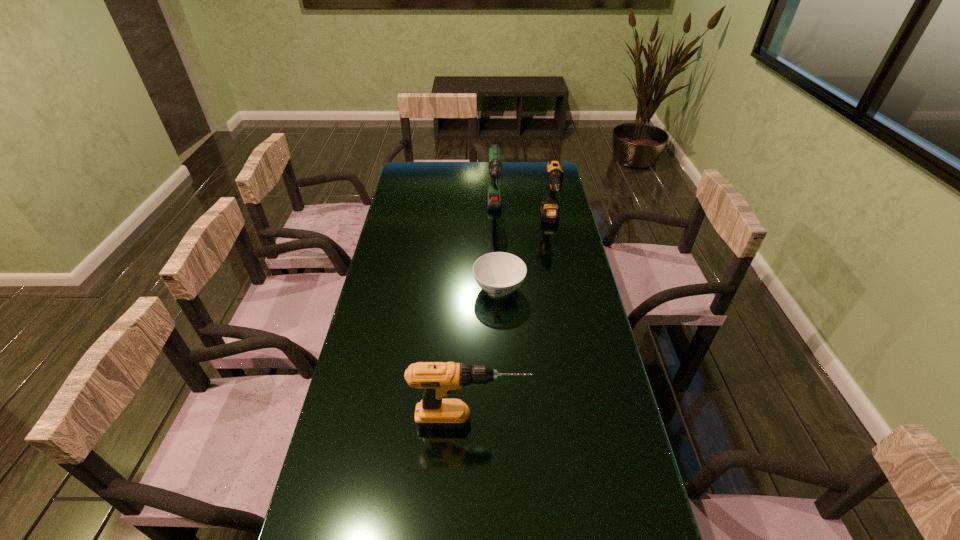
Where is `object that is the third closest to the chinaware`? object that is the third closest to the chinaware is located at coordinates (437, 379).

Select which object is the second closest to the rightmost drill. Please provide its 2D coordinates. Your answer should be formatted as a tuple, i.e. [(x, y)], where the tuple contains the x and y coordinates of a point satisfying the conditions above.

[(498, 273)]

What are the coordinates of `drill object that ranks as the second closest to the shortest object` in the screenshot? It's located at (550, 213).

Identify which drill is the second closest to the nearest drill. Please provide its 2D coordinates. Your answer should be formatted as a tuple, i.e. [(x, y)], where the tuple contains the x and y coordinates of a point satisfying the conditions above.

[(550, 213)]

Identify the location of free location that satisfies the following two spatial constraints: 1. at the tip of the rightmost object; 2. at the tip of the nearest drill. (591, 421).

Locate an element on the screen. This screenshot has height=540, width=960. vacant region that satisfies the following two spatial constraints: 1. at the tip of the rightmost drill; 2. at the tip of the nearest object is located at coordinates (591, 421).